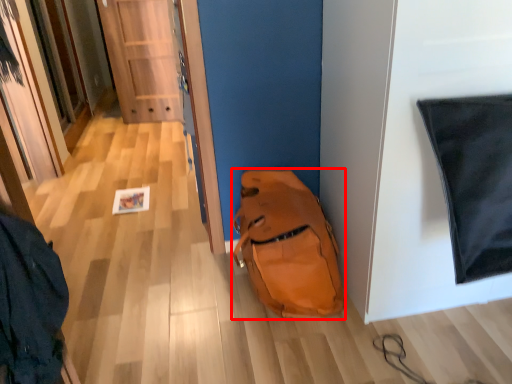
Question: Observing the image, what is the correct spatial positioning of backpack (annotated by the red box) in reference to door?

Choices:
 (A) right
 (B) left

Answer: (A)